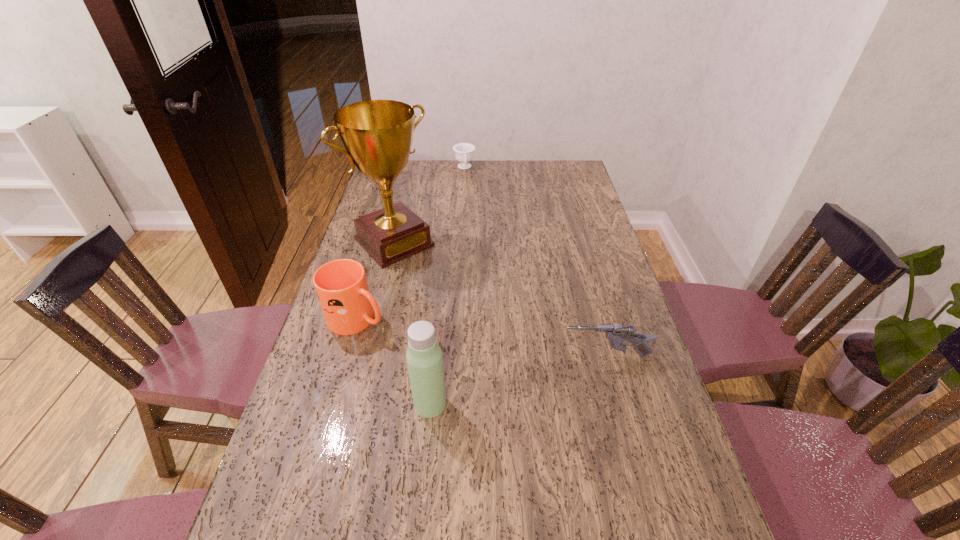
This screenshot has width=960, height=540. In order to click on free space that is in between the award and the farthest object in this screenshot , I will do `click(429, 205)`.

I want to click on vacant point located between the third farthest object and the fourth tallest object, so (482, 338).

This screenshot has width=960, height=540. I want to click on blank region between the teacup and the second farthest object, so click(x=429, y=205).

This screenshot has width=960, height=540. I want to click on free space that is in between the second farthest object and the second nearest object, so click(500, 299).

Where is `vacant area that lies between the teacup and the gun`? vacant area that lies between the teacup and the gun is located at coordinates (536, 262).

I want to click on object that stands as the second closest to the gun, so click(341, 286).

Identify which object is located as the nearest to the gun. Please provide its 2D coordinates. Your answer should be formatted as a tuple, i.e. [(x, y)], where the tuple contains the x and y coordinates of a point satisfying the conditions above.

[(424, 358)]

You are a GUI agent. You are given a task and a screenshot of the screen. Output one action in this format:
    pyautogui.click(x=<x>, y=<y>)
    Task: Click on the free location that satisfies the following two spatial constraints: 1. on the front side of the gun; 2. at the barrel of the mug
    The image size is (960, 540).
    Given the screenshot: What is the action you would take?
    pyautogui.click(x=347, y=356)

The width and height of the screenshot is (960, 540). I want to click on free space that satisfies the following two spatial constraints: 1. on the back side of the mug; 2. on the right side of the teacup, so click(401, 168).

You are a GUI agent. You are given a task and a screenshot of the screen. Output one action in this format:
    pyautogui.click(x=<x>, y=<y>)
    Task: Click on the free region that satisfies the following two spatial constraints: 1. on the front side of the rightmost object; 2. at the barrel of the third tallest object
    Image resolution: width=960 pixels, height=540 pixels.
    Given the screenshot: What is the action you would take?
    pyautogui.click(x=347, y=356)